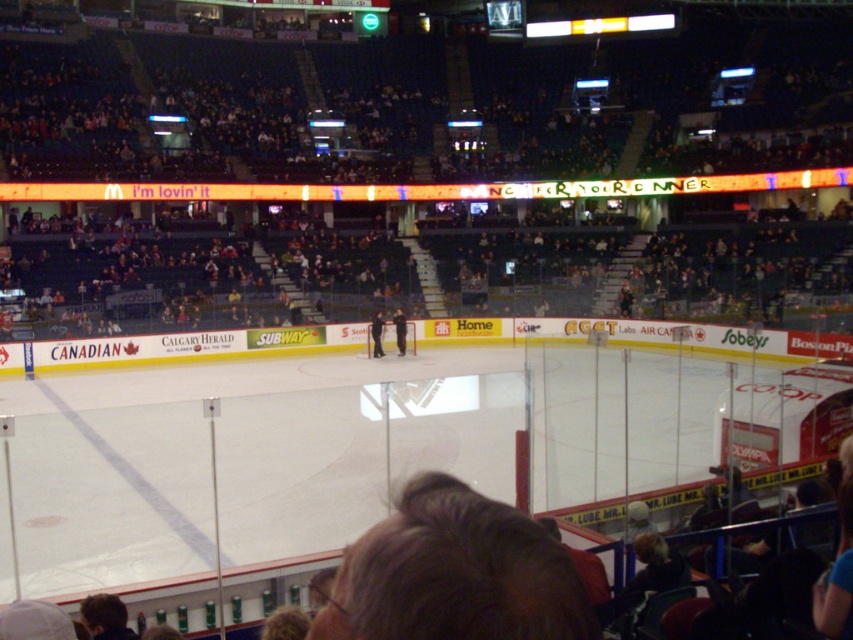
Is dark blue seats at upper center closer to camera compared to brown hair at center?

No, it is behind brown hair at center.

Can you confirm if dark blue seats at upper center is positioned above brown hair at center?

Yes, dark blue seats at upper center is above brown hair at center.

Is point (292, 205) farther from camera compared to point (439, 598)?

Yes, it is.

In order to click on dark blue seats at upper center in this screenshot , I will do `click(399, 113)`.

Does dark blue seats at upper center have a greater width compared to dark blue uniform at center?

Yes.

This screenshot has height=640, width=853. What are the coordinates of `dark blue seats at upper center` in the screenshot? It's located at coord(399,113).

Find the location of a particular element. dark blue seats at upper center is located at coordinates (399, 113).

Is brown hair at center to the right of black smooth hockey stick at center from the viewer's perspective?

Yes, brown hair at center is to the right of black smooth hockey stick at center.

Is brown hair at center further to camera compared to black smooth hockey stick at center?

No, it is not.

Describe the element at coordinates (454, 573) in the screenshot. I see `brown hair at center` at that location.

Locate an element on the screen. The height and width of the screenshot is (640, 853). brown hair at center is located at coordinates (454, 573).